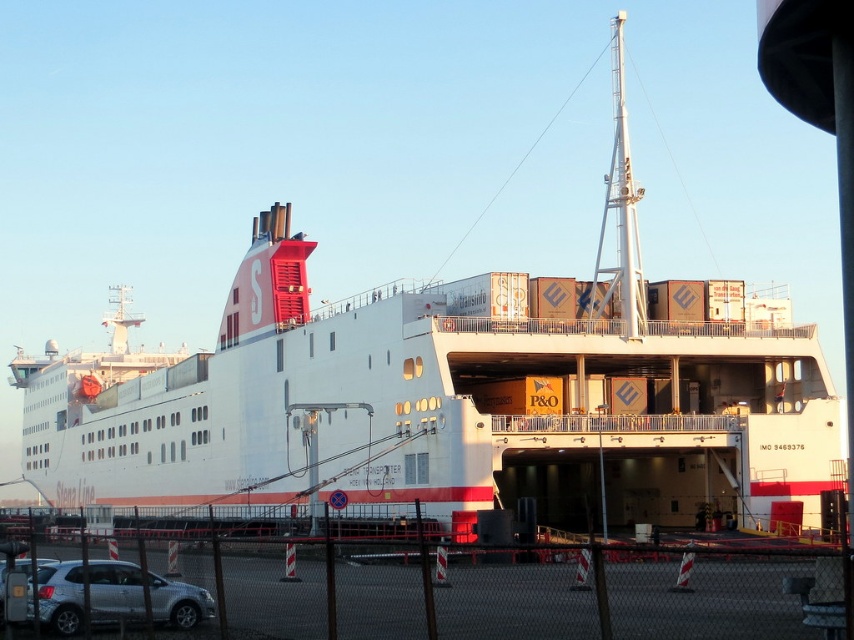
You are a passenger on the ferry and want to drive your car to the upper deck. You see a silver metallic suv at lower left and a silver metallic car at lower left. Which vehicle should you avoid driving over when ascending the ramp?

You should avoid driving over the silver metallic suv at lower left because it is positioned below the silver metallic car at lower left, meaning it is closer to the ramp and might be in your path.

You are standing at the viewer position in the scene. There is a silver metallic suv at lower left. Can you safely walk towards it without needing to cross any obstacles?

The silver metallic suv at lower left is 50.16 meters away from the viewer. Since there are no obstacles mentioned in the scene description, you can safely walk towards it.